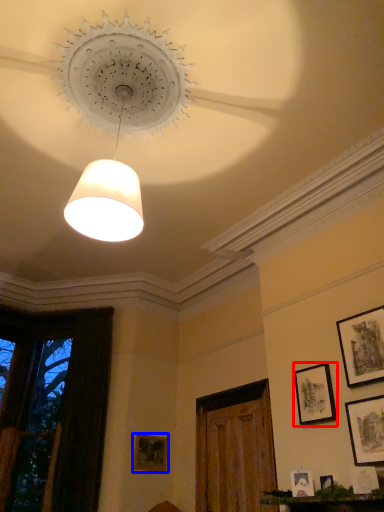
Question: Among these objects, which one is farthest to the camera, picture frame (highlighted by a red box) or picture frame (highlighted by a blue box)?

Choices:
 (A) picture frame
 (B) picture frame

Answer: (B)